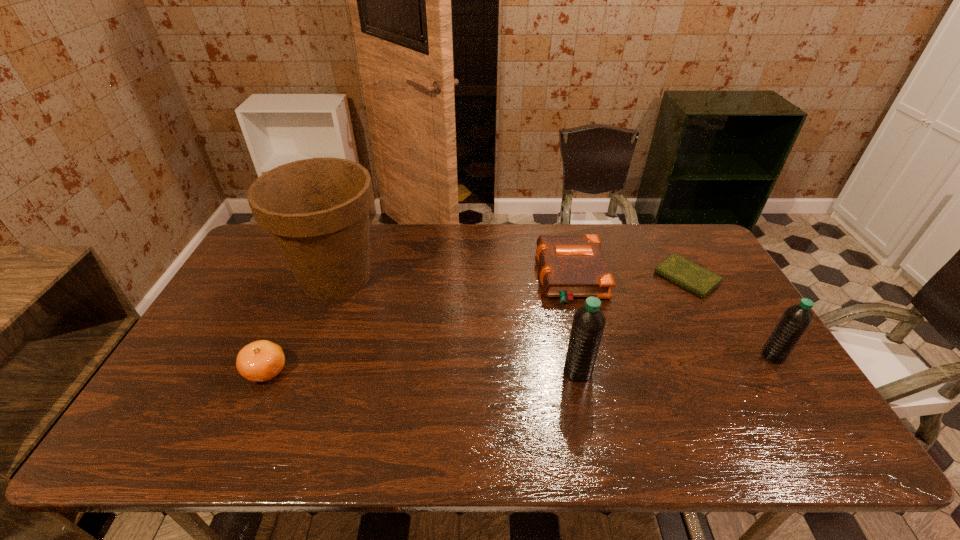
Locate an element on the screen. This screenshot has width=960, height=540. empty space that is in between the fifth tallest object and the shortest object is located at coordinates (629, 277).

The image size is (960, 540). I want to click on empty location between the Bible and the tallest object, so click(x=453, y=277).

This screenshot has height=540, width=960. In order to click on vacant area that lies between the flowerpot and the second tallest object in this screenshot , I will do `click(457, 324)`.

Where is `free space that is in between the shorter water bottle and the flowerpot`? The image size is (960, 540). free space that is in between the shorter water bottle and the flowerpot is located at coordinates (554, 316).

I want to click on empty location between the shortest object and the clementine, so click(x=476, y=325).

This screenshot has height=540, width=960. Identify the location of free space between the fourth tallest object and the fifth tallest object. (419, 324).

At what (x,y) coordinates should I click in order to perform the action: click on free space between the Bible and the flowerpot. Please return your answer as a coordinate pair (x, y). Image resolution: width=960 pixels, height=540 pixels. Looking at the image, I should click on (453, 277).

Locate an element on the screen. This screenshot has height=540, width=960. free space between the left water bottle and the tallest object is located at coordinates (457, 324).

Find the location of a particular element. Image resolution: width=960 pixels, height=540 pixels. vacant space in between the taller water bottle and the clementine is located at coordinates point(422,371).

Locate an element on the screen. object that is the fourth closest to the diary is located at coordinates (317, 210).